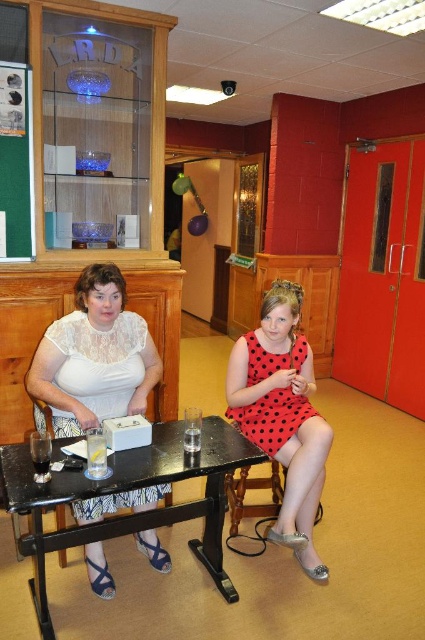
Is black wood table at center above green fabric bulletin board at left?

Incorrect, black wood table at center is not positioned above green fabric bulletin board at left.

Find the location of a particular element. Image resolution: width=425 pixels, height=640 pixels. black wood table at center is located at coordinates (130, 490).

You are a GUI agent. You are given a task and a screenshot of the screen. Output one action in this format:
    pyautogui.click(x=<x>, y=<y>)
    Task: Click on the black wood table at center
    Image resolution: width=425 pixels, height=640 pixels.
    Given the screenshot: What is the action you would take?
    coord(130,490)

Does point (138, 522) lie behind point (303, 456)?

No, (138, 522) is closer to viewer.

Find the location of `black wood table at center`. black wood table at center is located at coordinates (130, 490).

Is point (104, 289) less distant than point (34, 216)?

Yes, point (104, 289) is closer to viewer.

This screenshot has height=640, width=425. What do you see at coordinates (95, 356) in the screenshot?
I see `white lace dress at center` at bounding box center [95, 356].

Is point (119, 390) in front of point (17, 227)?

Yes.

Find the location of a particular element. The width and height of the screenshot is (425, 640). white lace dress at center is located at coordinates (95, 356).